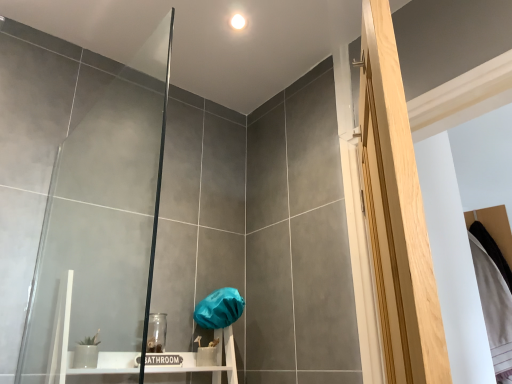
Question: Does transparent glass door at left come behind light wood screen door at right?

Choices:
 (A) yes
 (B) no

Answer: (A)

Question: Is light wood screen door at right completely or partially inside transparent glass door at left?

Choices:
 (A) no
 (B) yes

Answer: (A)

Question: Does transparent glass door at left turn towards light wood screen door at right?

Choices:
 (A) yes
 (B) no

Answer: (B)

Question: Is transparent glass door at left positioned with its back to light wood screen door at right?

Choices:
 (A) no
 (B) yes

Answer: (A)

Question: Can you confirm if transparent glass door at left is positioned to the right of light wood screen door at right?

Choices:
 (A) no
 (B) yes

Answer: (A)

Question: Can you confirm if transparent glass door at left is positioned to the left of light wood screen door at right?

Choices:
 (A) yes
 (B) no

Answer: (A)

Question: Is light wood screen door at right positioned behind transparent glass door at left?

Choices:
 (A) yes
 (B) no

Answer: (B)

Question: Could you tell me if light wood screen door at right is facing transparent glass door at left?

Choices:
 (A) no
 (B) yes

Answer: (A)

Question: Is light wood screen door at right in front of transparent glass door at left?

Choices:
 (A) no
 (B) yes

Answer: (B)

Question: Is light wood screen door at right wider than transparent glass door at left?

Choices:
 (A) yes
 (B) no

Answer: (B)

Question: From the image's perspective, is light wood screen door at right on transparent glass door at left?

Choices:
 (A) yes
 (B) no

Answer: (A)

Question: Is light wood screen door at right bigger than transparent glass door at left?

Choices:
 (A) no
 (B) yes

Answer: (B)

Question: Is transparent glass door at left taller or shorter than light wood screen door at right?

Choices:
 (A) short
 (B) tall

Answer: (A)